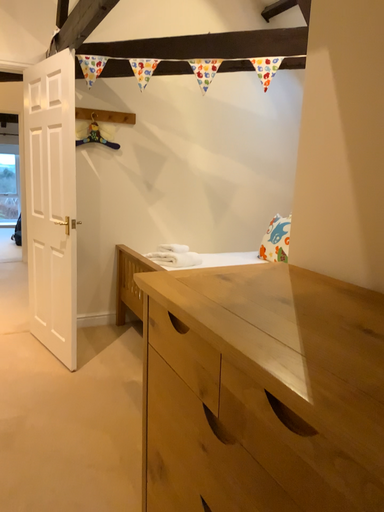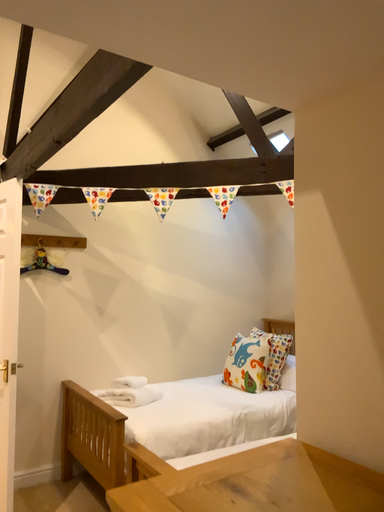
Question: How did the camera likely rotate when shooting the video?

Choices:
 (A) rotated right
 (B) rotated left

Answer: (A)